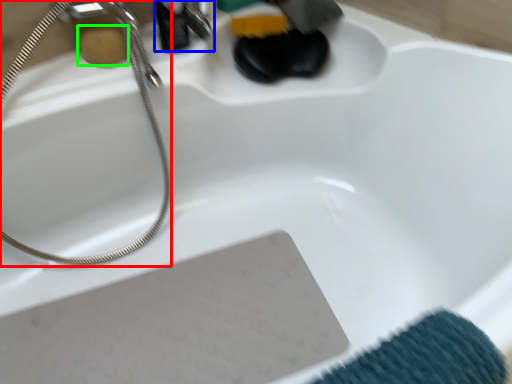
Question: Which object is positioned farthest from shower (highlighted by a red box)? Select from faucet (highlighted by a blue box) and soap (highlighted by a green box).

Choices:
 (A) faucet
 (B) soap

Answer: (A)